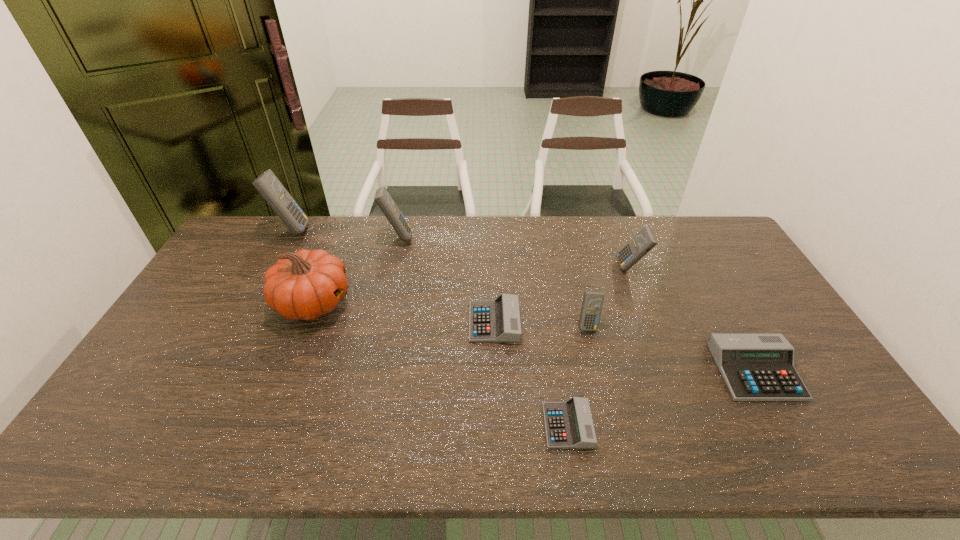
Where is `free location that satisfies the following two spatial constraints: 1. on the front-facing side of the rightmost calculator; 2. on the right side of the third smallest blue calculator`? Image resolution: width=960 pixels, height=540 pixels. free location that satisfies the following two spatial constraints: 1. on the front-facing side of the rightmost calculator; 2. on the right side of the third smallest blue calculator is located at coordinates (366, 371).

Find the location of a particular element. vacant region that satisfies the following two spatial constraints: 1. on the front-facing side of the biggest blue calculator; 2. on the right side of the shortest object is located at coordinates (185, 426).